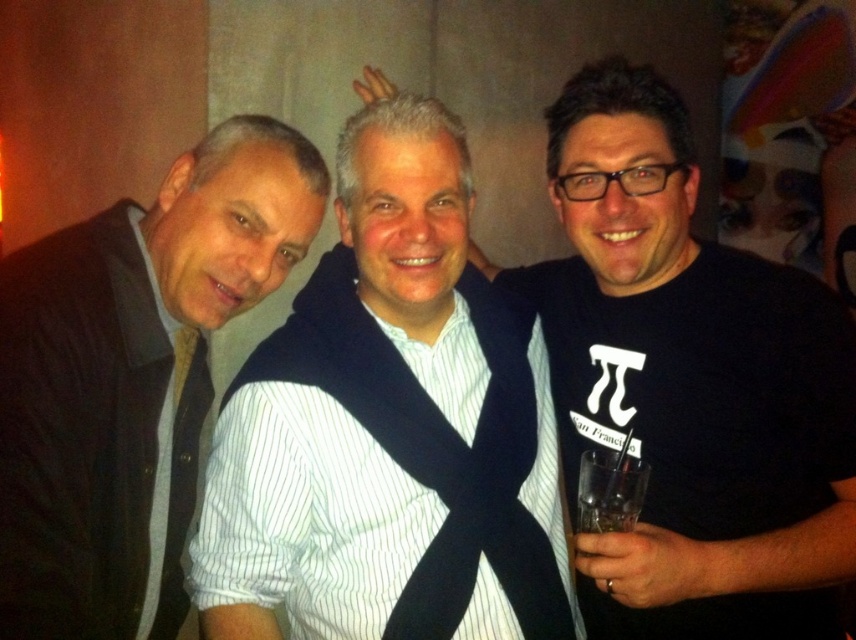
Question: Considering the real-world distances, which object is farthest from the matte black jacket at left?

Choices:
 (A) black matte t-shirt at right
 (B) white striped shirt at center

Answer: (A)

Question: From the image, what is the correct spatial relationship of white striped shirt at center in relation to black matte t-shirt at right?

Choices:
 (A) left
 (B) right

Answer: (A)

Question: Is the position of white striped shirt at center more distant than that of black matte t-shirt at right?

Choices:
 (A) yes
 (B) no

Answer: (A)

Question: Among these points, which one is farthest from the camera?

Choices:
 (A) (421, 445)
 (B) (171, 237)

Answer: (B)

Question: Where is black matte t-shirt at right located in relation to matte black jacket at left in the image?

Choices:
 (A) below
 (B) above

Answer: (A)

Question: Which object appears farthest from the camera in this image?

Choices:
 (A) matte black jacket at left
 (B) white striped shirt at center
 (C) black matte t-shirt at right

Answer: (B)